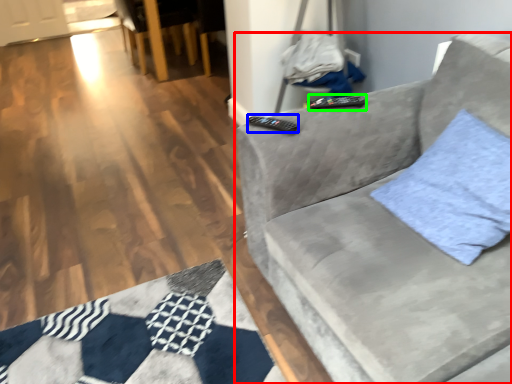
Question: Which object is positioned farthest from studio couch (highlighted by a red box)? Select from remote (highlighted by a blue box) and remote (highlighted by a green box).

Choices:
 (A) remote
 (B) remote

Answer: (A)